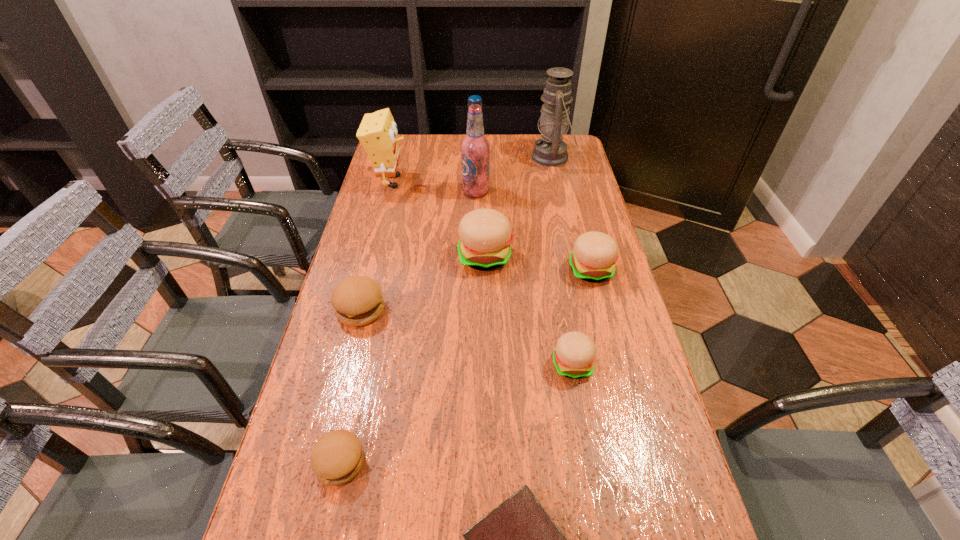
The image size is (960, 540). Find the location of `hamburger that stands as the second closest to the fourth farthest hamburger`. hamburger that stands as the second closest to the fourth farthest hamburger is located at coordinates (485, 235).

Where is `hamburger that is the closest to the tallest hamburger`? The width and height of the screenshot is (960, 540). hamburger that is the closest to the tallest hamburger is located at coordinates (594, 254).

Choose which beige hamburger is the nearest neighbor to the seventh farthest object. Please provide its 2D coordinates. Your answer should be formatted as a tuple, i.e. [(x, y)], where the tuple contains the x and y coordinates of a point satisfying the conditions above.

[(594, 254)]

Choose which beige hamburger is the nearest neighbor to the Bible. Please provide its 2D coordinates. Your answer should be formatted as a tuple, i.e. [(x, y)], where the tuple contains the x and y coordinates of a point satisfying the conditions above.

[(574, 355)]

Where is `vacant region that satisfies the following two spatial constraints: 1. on the back side of the oil lamp; 2. on the right side of the blue alcohol`? The height and width of the screenshot is (540, 960). vacant region that satisfies the following two spatial constraints: 1. on the back side of the oil lamp; 2. on the right side of the blue alcohol is located at coordinates (476, 157).

This screenshot has height=540, width=960. I want to click on free region that satisfies the following two spatial constraints: 1. on the face of the bigger brown hamburger; 2. on the right side of the sponge, so click(357, 309).

Find the location of a particular element. This screenshot has width=960, height=540. free space that satisfies the following two spatial constraints: 1. on the front side of the fourth farthest hamburger; 2. on the left side of the leftmost beige hamburger is located at coordinates (486, 364).

This screenshot has height=540, width=960. I want to click on free space that satisfies the following two spatial constraints: 1. on the face of the second shortest object; 2. on the left side of the sponge, so click(x=318, y=462).

In order to click on free location that satisfies the following two spatial constraints: 1. on the back side of the smallest beige hamburger; 2. on the face of the sponge in this screenshot , I will do `click(540, 181)`.